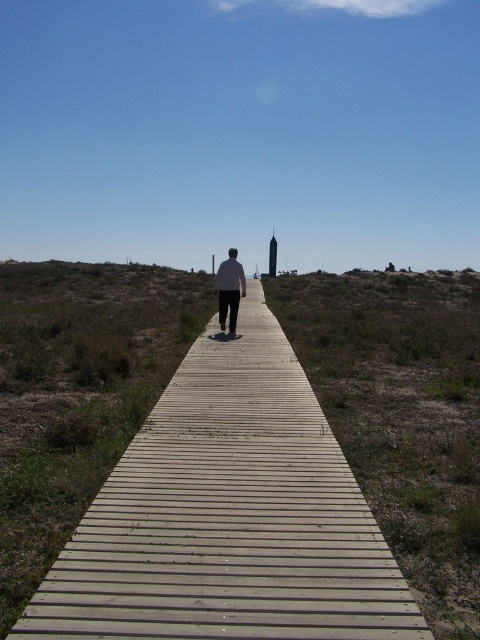
You are standing at the starting point of the boardwalk and notice the wooden planks at center and the white matte shirt at center. Which object appears taller from your perspective?

The white matte shirt at center appears taller because the wooden planks at center has a lesser height compared to it.

You are standing at the starting point of the boardwalk and see two points marked on the boardwalk ahead of you. Which point is closer to you, point (165, 472) or point (224, 304)?

Point (165, 472) is closer to the camera than point (224, 304), so the point closer to you is point (165, 472).